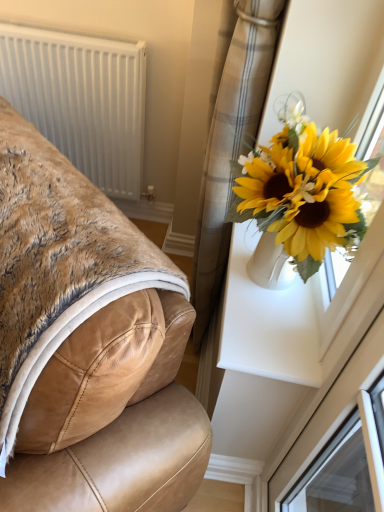
Question: Is point (203, 308) closer or farther from the camera than point (26, 39)?

Choices:
 (A) farther
 (B) closer

Answer: (B)

Question: Is plaid fabric curtain at upper right inside the boundaries of white plastic radiator at upper left, or outside?

Choices:
 (A) outside
 (B) inside

Answer: (A)

Question: Which is nearer to the white plastic window frame at upper right?

Choices:
 (A) white plastic radiator at upper left
 (B) tan leather chair at left
 (C) plaid fabric curtain at upper right

Answer: (C)

Question: Based on their relative distances, which object is farther from the plaid fabric curtain at upper right?

Choices:
 (A) white plastic window frame at upper right
 (B) tan leather chair at left
 (C) white plastic radiator at upper left

Answer: (C)